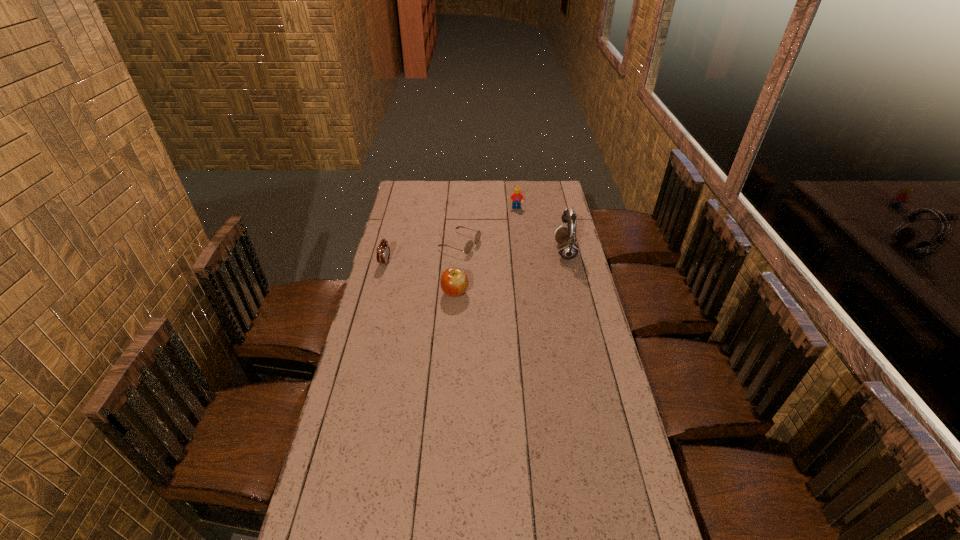
I want to click on free point between the farthest object and the apple, so click(x=486, y=251).

At what (x,y) coordinates should I click in order to perform the action: click on blank region between the sunglasses and the leftmost object. Please return your answer as a coordinate pair (x, y). The height and width of the screenshot is (540, 960). Looking at the image, I should click on (422, 253).

Identify the location of the fourth closest object relative to the nearest object. (516, 198).

Choose which object is the nearest neighbor to the alarm clock. Please provide its 2D coordinates. Your answer should be formatted as a tuple, i.e. [(x, y)], where the tuple contains the x and y coordinates of a point satisfying the conditions above.

[(468, 247)]

Locate an element on the screen. vacant position in the image that satisfies the following two spatial constraints: 1. on the front side of the earphone; 2. on the ear pads of the Lego is located at coordinates (521, 252).

What are the coordinates of `vacant space that satisfies the following two spatial constraints: 1. on the back side of the alarm clock; 2. on the ear pads of the rightmost object` in the screenshot? It's located at (388, 252).

This screenshot has height=540, width=960. What are the coordinates of `vacant space that satisfies the following two spatial constraints: 1. on the back side of the leftmost object; 2. on the right side of the fourth object from left to right` in the screenshot? It's located at (399, 208).

Locate an element on the screen. free point that satisfies the following two spatial constraints: 1. on the back side of the rightmost object; 2. on the ear pads of the alarm clock is located at coordinates (388, 252).

Locate an element on the screen. This screenshot has height=540, width=960. free space that satisfies the following two spatial constraints: 1. on the back side of the earphone; 2. on the ear pads of the apple is located at coordinates (458, 252).